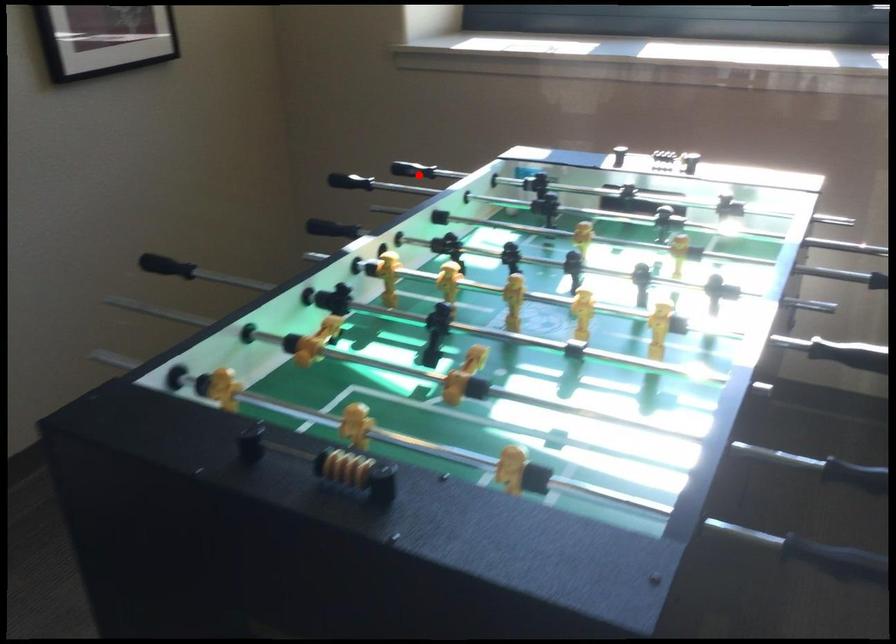
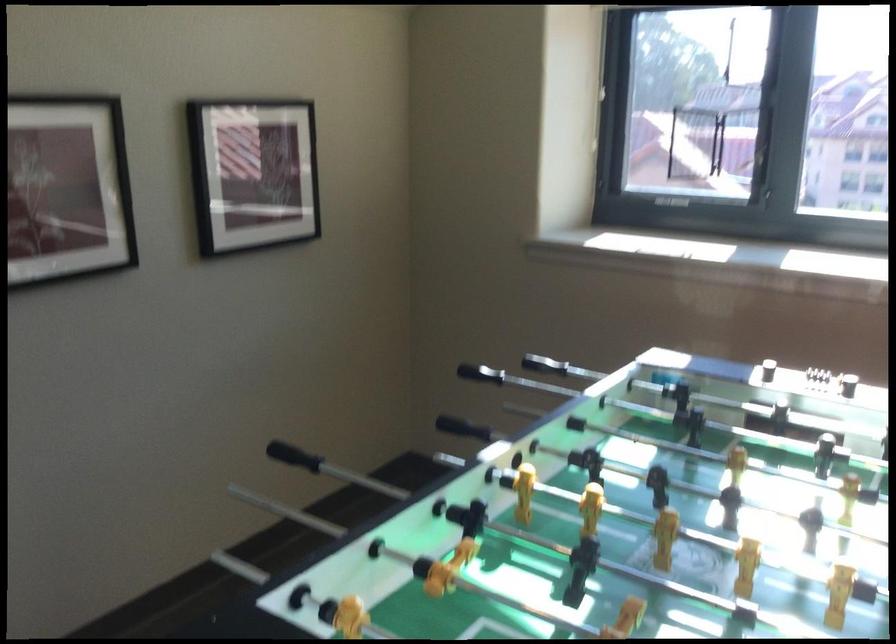
In the second image, find the point that corresponds to the highlighted location in the first image.

(544, 365)